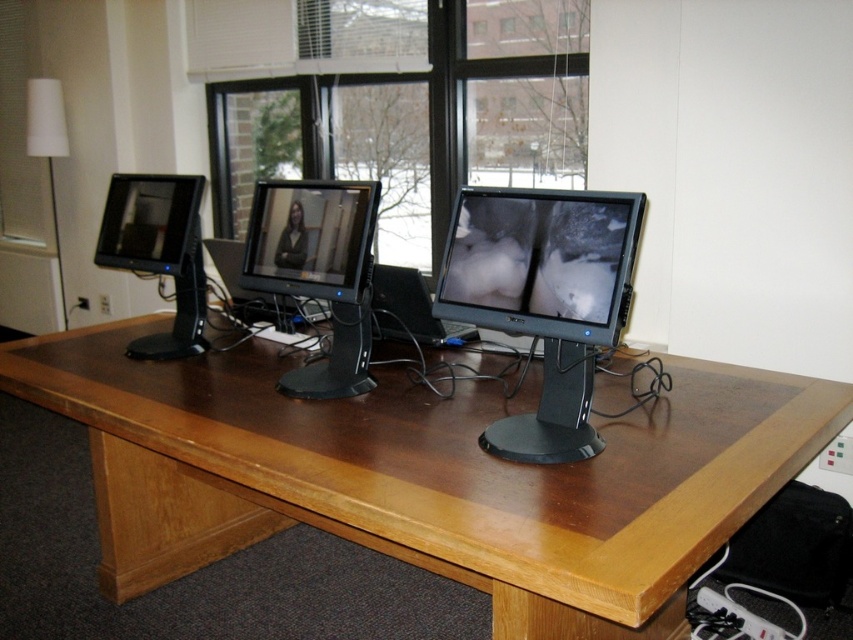
Looking at this image, which is above, wooden computer desk at center or matte black monitor at left?

matte black monitor at left is above.

Is wooden computer desk at center below matte black monitor at left?

Correct, wooden computer desk at center is located below matte black monitor at left.

Between point (440, 448) and point (132, 204), which one is positioned behind?

Point (132, 204)

This screenshot has width=853, height=640. I want to click on wooden computer desk at center, so click(x=425, y=474).

Does matte black monitor at center have a lesser width compared to matte black monitor at left?

No.

Does point (276, 282) come in front of point (193, 220)?

Yes.

Where is `matte black monitor at center`? This screenshot has width=853, height=640. matte black monitor at center is located at coordinates (311, 237).

Who is positioned more to the left, wooden computer desk at center or transparent glass window at center?

Positioned to the left is transparent glass window at center.

What do you see at coordinates (425, 474) in the screenshot? This screenshot has width=853, height=640. I see `wooden computer desk at center` at bounding box center [425, 474].

Which is behind, point (682, 364) or point (444, 168)?

The point (444, 168) is more distant.

At what (x,y) coordinates should I click in order to perform the action: click on wooden computer desk at center. Please return your answer as a coordinate pair (x, y). The image size is (853, 640). Looking at the image, I should click on (425, 474).